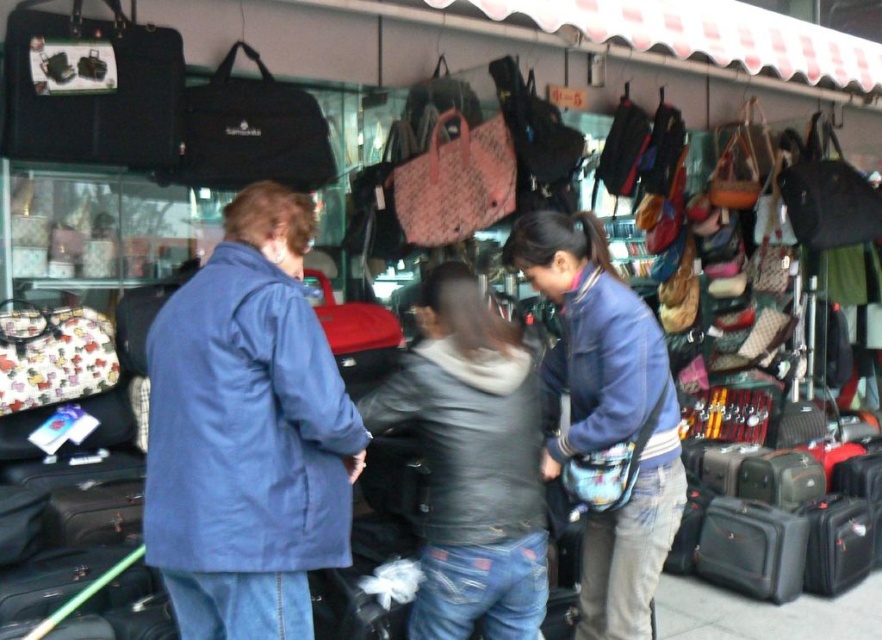
What do you see at coordinates (606, 419) in the screenshot? The width and height of the screenshot is (882, 640). I see `denim jacket at center` at bounding box center [606, 419].

Is the position of denim jacket at center more distant than that of matte black briefcase at upper left?

No.

Is point (576, 442) more distant than point (9, 60)?

No, (576, 442) is in front of (9, 60).

In order to click on denim jacket at center in this screenshot , I will do `click(606, 419)`.

Locate an element on the screen. The height and width of the screenshot is (640, 882). blue matte jacket at center is located at coordinates (247, 433).

Which is in front, point (290, 472) or point (446, 339)?

Point (290, 472) is in front.

Is point (168, 420) closer to viewer compared to point (465, 406)?

Yes, point (168, 420) is closer to viewer.

Locate an element on the screen. The width and height of the screenshot is (882, 640). blue matte jacket at center is located at coordinates (247, 433).

Who is higher up, black fabric bag at upper center or leather handbag at center?

black fabric bag at upper center is above.

Who is more forward, (290, 92) or (365, 173)?

Point (290, 92)

Between point (314, 131) and point (407, 144), which one is positioned behind?

Positioned behind is point (407, 144).

This screenshot has height=640, width=882. Identify the location of black fabric bag at upper center. (250, 132).